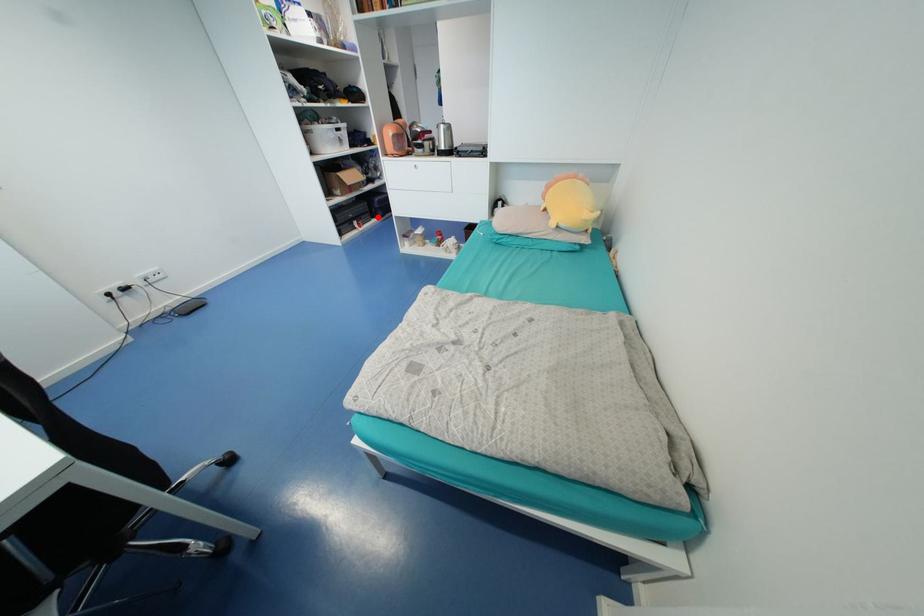
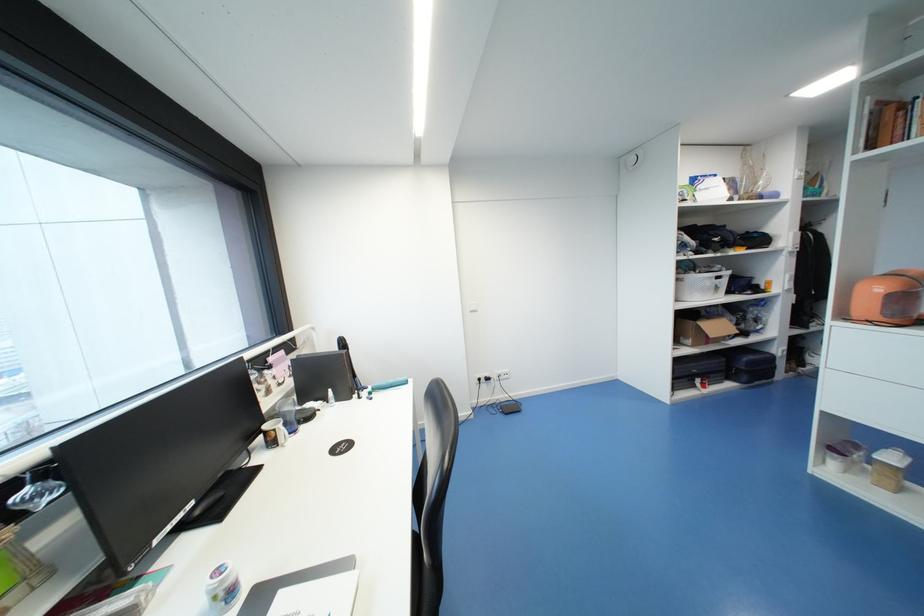
Where in the second image is the point corresponding to the highlighted location from the first image?

(733, 379)